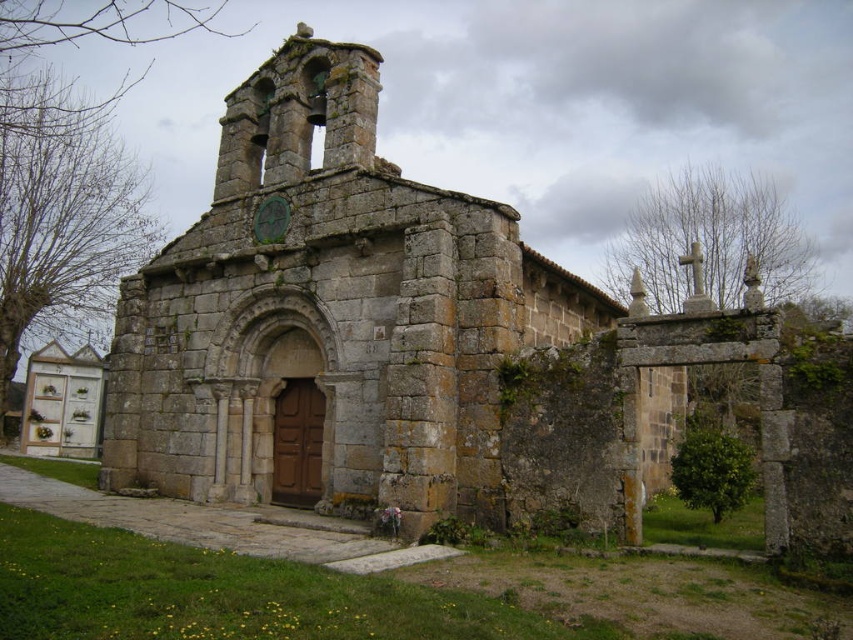
Does stone chapel at center lie in front of green stone clock at upper center?

Yes, it is.

Is point (331, 244) farther from camera compared to point (260, 209)?

No, it is not.

Is point (448, 310) behind point (276, 196)?

No, (448, 310) is in front of (276, 196).

Find the location of a particular element. This screenshot has height=640, width=853. stone chapel at center is located at coordinates (328, 317).